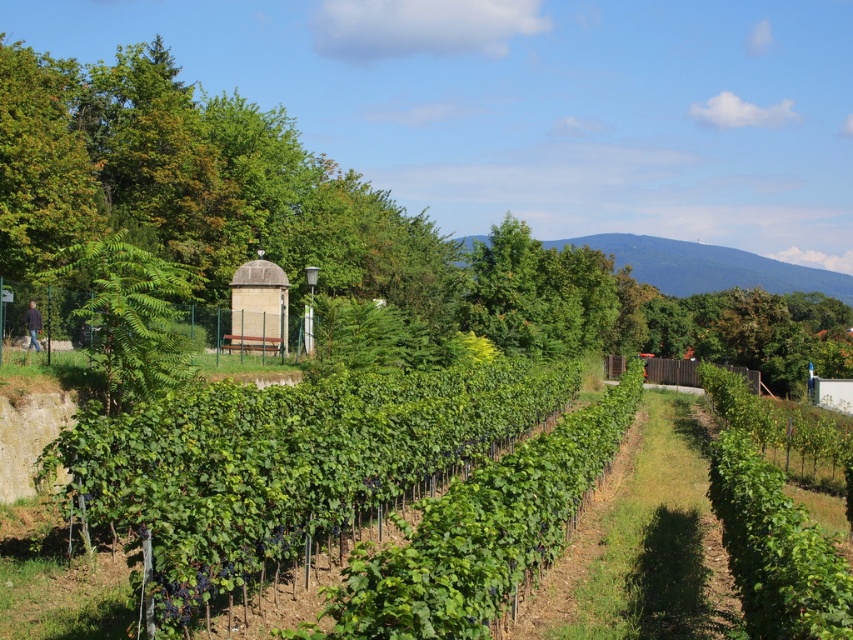
Who is taller, green leafy tree at left or blue-green grassy hillside at upper center?

blue-green grassy hillside at upper center is taller.

Which is in front, point (97, 291) or point (646, 244)?

Point (97, 291) is in front.

Locate an element on the screen. The image size is (853, 640). green leafy tree at left is located at coordinates (129, 317).

Does green leafy hedge at center appear under green leafy tree at left?

Indeed, green leafy hedge at center is positioned under green leafy tree at left.

Who is positioned more to the right, green leafy hedge at center or green leafy tree at left?

Positioned to the right is green leafy hedge at center.

I want to click on green leafy hedge at center, so click(358, 486).

The height and width of the screenshot is (640, 853). Find the location of `green leafy hedge at center`. green leafy hedge at center is located at coordinates (358, 486).

Does green leafy hedge at center appear under blue-green grassy hillside at upper center?

Indeed, green leafy hedge at center is positioned under blue-green grassy hillside at upper center.

The width and height of the screenshot is (853, 640). I want to click on green leafy hedge at center, so click(358, 486).